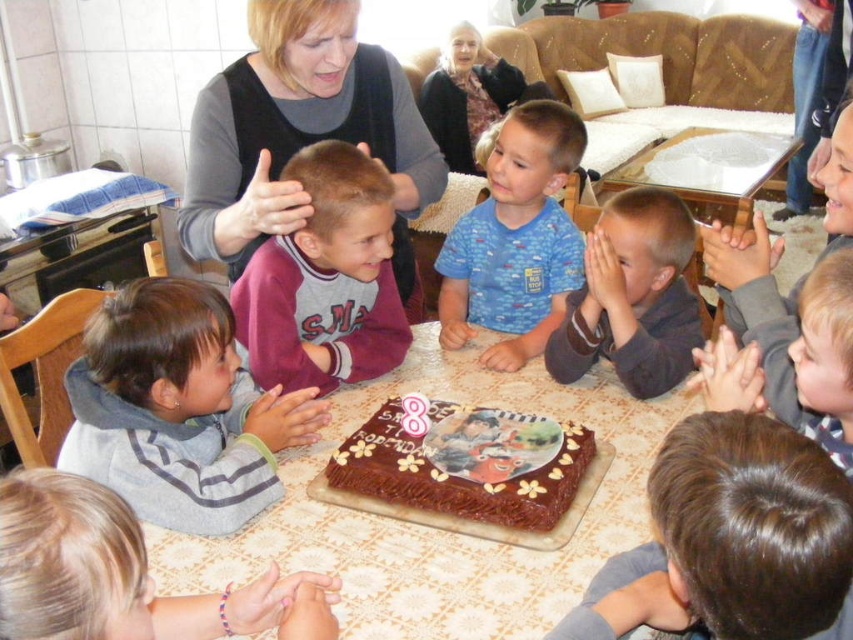
Question: Does gray fleece jacket at lower left appear on the left side of purple fleece sweater at center?

Choices:
 (A) yes
 (B) no

Answer: (A)

Question: Among these objects, which one is farthest from the camera?

Choices:
 (A) smooth brown shirt at center
 (B) matte gray sweater at upper left
 (C) dark gray sweater at upper center
 (D) blue cotton shirt at center

Answer: (C)

Question: In this image, where is gray fleece sweater at lower left located relative to chocolatesmoothcake at center?

Choices:
 (A) left
 (B) right

Answer: (A)

Question: Which of the following is the closest to the observer?

Choices:
 (A) (445, 108)
 (B) (807, 525)
 (C) (579, 454)

Answer: (B)

Question: Does gray fleece sweater at lower left have a smaller size compared to smooth brown shirt at center?

Choices:
 (A) yes
 (B) no

Answer: (B)

Question: Which point is farther to the camera?

Choices:
 (A) brown matte hair at lower right
 (B) purple fleece sweater at center
 (C) smooth brown shirt at center

Answer: (C)